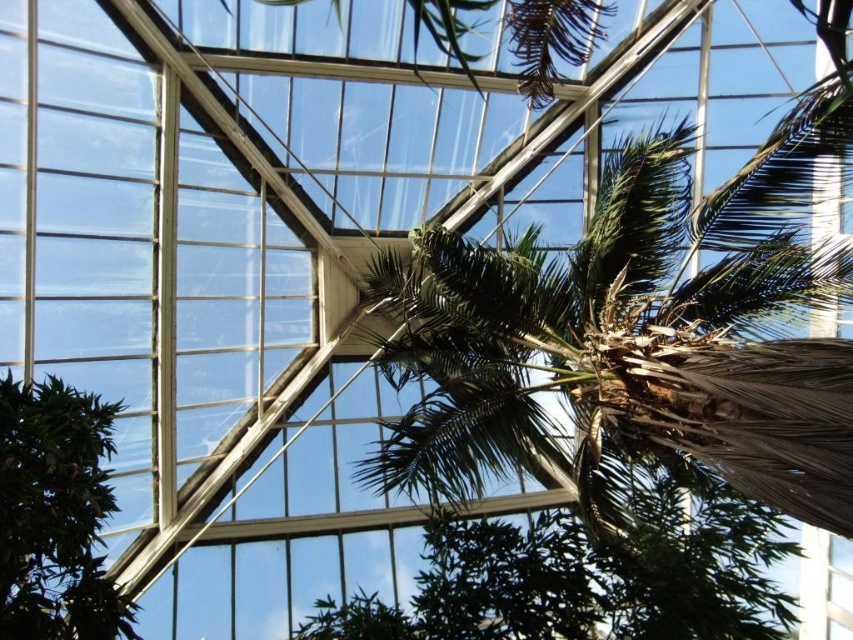
You are planning to place a large decorative statue in the greenhouse. The statue requires a space that is wider than the green leafy palm tree at center. Is there enough space near the green leafy tree at lower left for the statue?

The green leafy palm tree at center might be wider than the green leafy tree at lower left, so there might not be enough space near the green leafy tree at lower left for the statue if it requires a wider space than the palm tree.

You are standing in the greenhouse and want to move from the green leafy tree at lower left to the exit door located at the far right corner. Which direction should you head towards to avoid the green leafy palm tree at center?

You should head towards the right side to avoid the green leafy palm tree at center, as the green leafy palm tree at center is positioned on the right side of green leafy tree at lower left, so moving right would take you around it towards the exit.

You are standing inside the greenhouse and want to take a photo of the green leafy palm tree at center and the green leafy tree at lower left. Which tree should you focus on first if you want to capture both in sharp focus?

You should focus on the green leafy palm tree at center first because it is closer to the viewer than the green leafy tree at lower left. By focusing on the closer object, you can ensure that both are in acceptable focus if they are within the depth of field range.